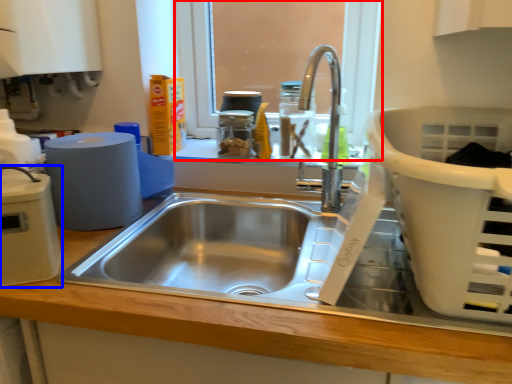
Question: Which of the following is the farthest to the observer, window screen (highlighted by a red box) or appliance (highlighted by a blue box)?

Choices:
 (A) window screen
 (B) appliance

Answer: (A)